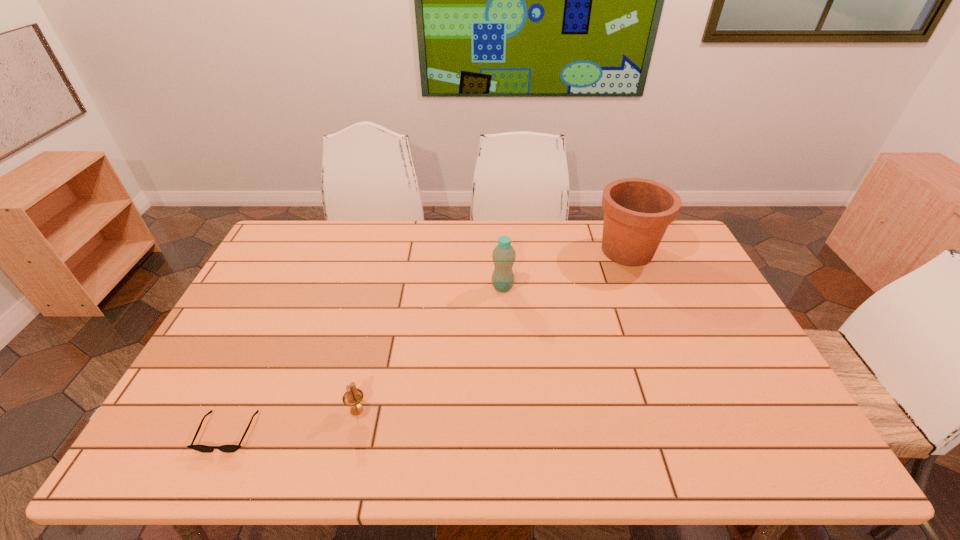
You are a GUI agent. You are given a task and a screenshot of the screen. Output one action in this format:
    pyautogui.click(x=<x>, y=<y>)
    Task: Click on the free area in between the third object from right to left and the sunglasses
    
    Given the screenshot: What is the action you would take?
    pyautogui.click(x=293, y=421)

At what (x,y) coordinates should I click in order to perform the action: click on free space between the shortest object and the candle holder. Please return your answer as a coordinate pair (x, y). The image size is (960, 540). Looking at the image, I should click on (293, 421).

Where is `vacant space that's between the farthest object and the sunglasses`? The image size is (960, 540). vacant space that's between the farthest object and the sunglasses is located at coordinates (427, 341).

What are the coordinates of `blank region between the water bottle and the leftmost object` in the screenshot? It's located at (365, 360).

Image resolution: width=960 pixels, height=540 pixels. In order to click on free space between the shortest object and the flowerpot in this screenshot , I will do `click(427, 341)`.

This screenshot has height=540, width=960. In order to click on object that is the closest to the farthest object in this screenshot , I will do `click(503, 255)`.

I want to click on object that is the closest to the third tallest object, so click(x=201, y=448).

At what (x,y) coordinates should I click in order to perform the action: click on free space in the image that satisfies the following two spatial constraints: 1. at the front cap of the third object from left to right; 2. on the front-facing side of the sunglasses. Please return your answer as a coordinate pair (x, y). This screenshot has height=540, width=960. Looking at the image, I should click on (511, 432).

Identify the location of vacant space that satisfies the following two spatial constraints: 1. at the front cap of the third nearest object; 2. on the front-facing side of the sunglasses. (511, 432).

Find the location of a particular element. The image size is (960, 540). blank area in the image that satisfies the following two spatial constraints: 1. at the front cap of the third nearest object; 2. on the front-facing side of the sunglasses is located at coordinates (511, 432).